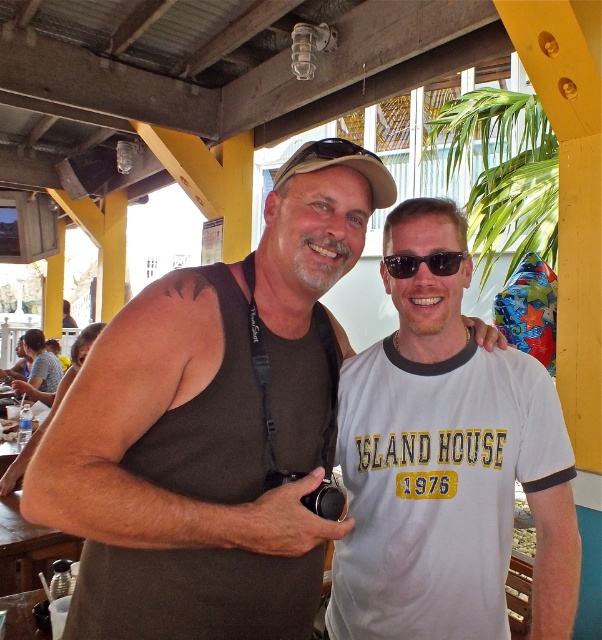
Is brown matte tank top at center smaller than matte brown goggles at center?

No, brown matte tank top at center is not smaller than matte brown goggles at center.

Who is more forward, (294,280) or (361,157)?

Point (361,157)

You are a GUI agent. You are given a task and a screenshot of the screen. Output one action in this format:
    pyautogui.click(x=<x>, y=<y>)
    Task: Click on the brown matte tank top at center
    
    Given the screenshot: What is the action you would take?
    pyautogui.click(x=209, y=435)

Is brown fabric tank top at left to the right of matte brown goggles at center from the viewer's perspective?

In fact, brown fabric tank top at left is to the left of matte brown goggles at center.

Does point (297, 381) lie behind point (374, 161)?

Yes, point (297, 381) is farther from viewer.

Is point (122, 563) more distant than point (282, 164)?

No, (122, 563) is closer to viewer.

Locate an element on the screen. brown fabric tank top at left is located at coordinates [246, 410].

Is point (119, 401) positioned in front of point (152, 573)?

Yes.

Looking at this image, which is more to the right, brown matte tank top at center or brown fabric tank top at left?

From the viewer's perspective, brown fabric tank top at left appears more on the right side.

Between point (237, 608) and point (123, 467), which one is positioned behind?

The point (237, 608) is behind.

Identify the location of brown matte tank top at center. Image resolution: width=602 pixels, height=640 pixels. (209, 435).